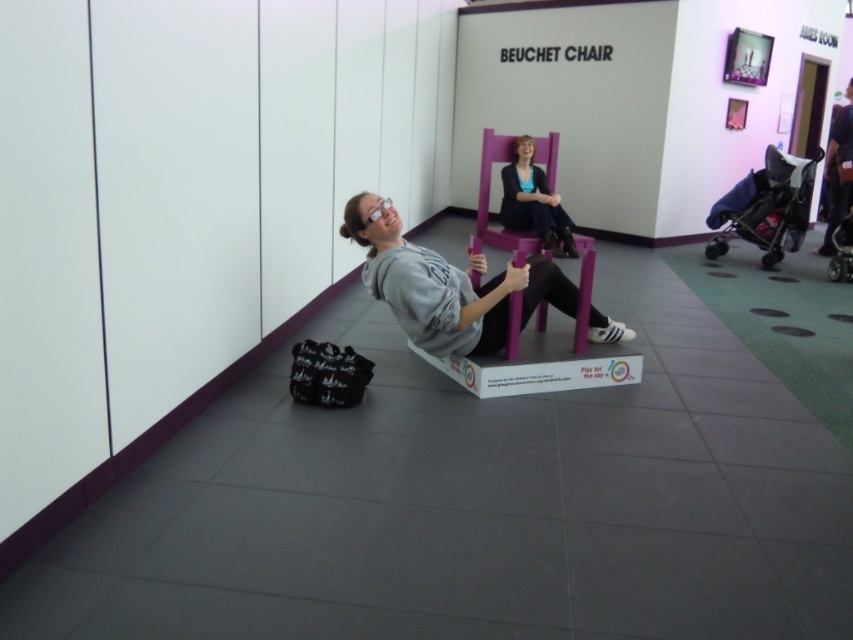
Question: Which object appears closest to the camera in this image?

Choices:
 (A) matte purple chair at center
 (B) matte gray hoodie at center

Answer: (B)

Question: Can you confirm if blue fabric baby carriage at right is positioned above dark gray fabric pants at right?

Choices:
 (A) no
 (B) yes

Answer: (A)

Question: Is blue fabric baby carriage at right above matte purple chair at center?

Choices:
 (A) yes
 (B) no

Answer: (A)

Question: Among these objects, which one is farthest from the camera?

Choices:
 (A) blue fabric baby carriage at right
 (B) dark gray fabric pants at right
 (C) matte gray hoodie at center
 (D) matte purple chair at center

Answer: (B)

Question: Based on their relative distances, which object is nearer to the purple matte chair at center?

Choices:
 (A) matte gray hoodie at center
 (B) dark gray fabric pants at right
 (C) blue fabric baby carriage at right
 (D) matte purple chair at center

Answer: (D)

Question: In this image, where is matte gray hoodie at center located relative to matte purple chair at center?

Choices:
 (A) above
 (B) below

Answer: (B)